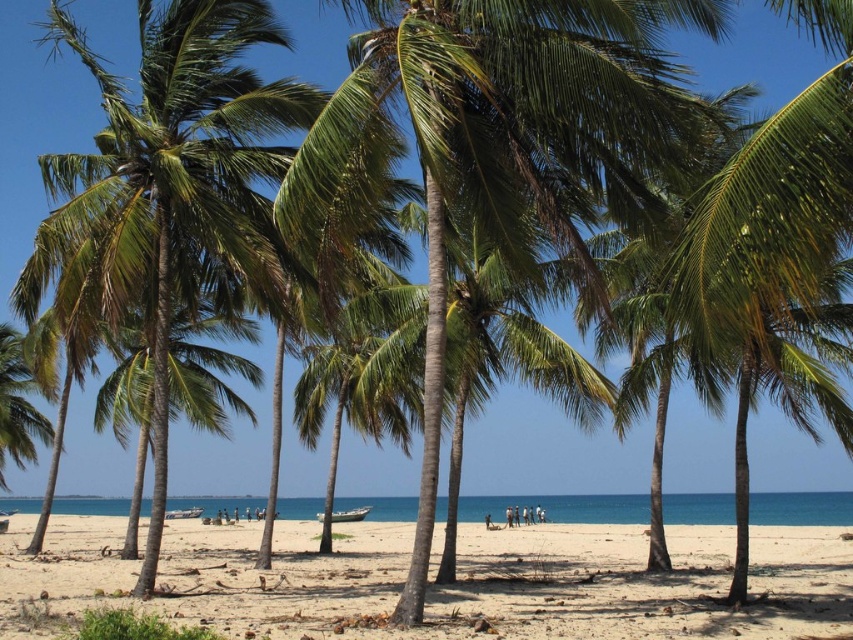
You are standing at the beach and see two points marked on the sand. The first point is at coordinates point (x=210, y=540) and the second is at point (x=270, y=154). If you want to walk from the first point to the second point, will you have to go around any obstacles? Please explain based on their positions.

Point (x=210, y=540) is behind point (x=270, y=154), so walking from the first point to the second point would require moving forward without needing to go around any obstacles since the first point is positioned behind the second one.

You are standing on the beach and want to walk from the light beige sand at center to the green leafy palm tree at left. Which direction should you face to walk directly towards the tree?

You should face towards the left direction to walk directly towards the green leafy palm tree at left from the light beige sand at center.